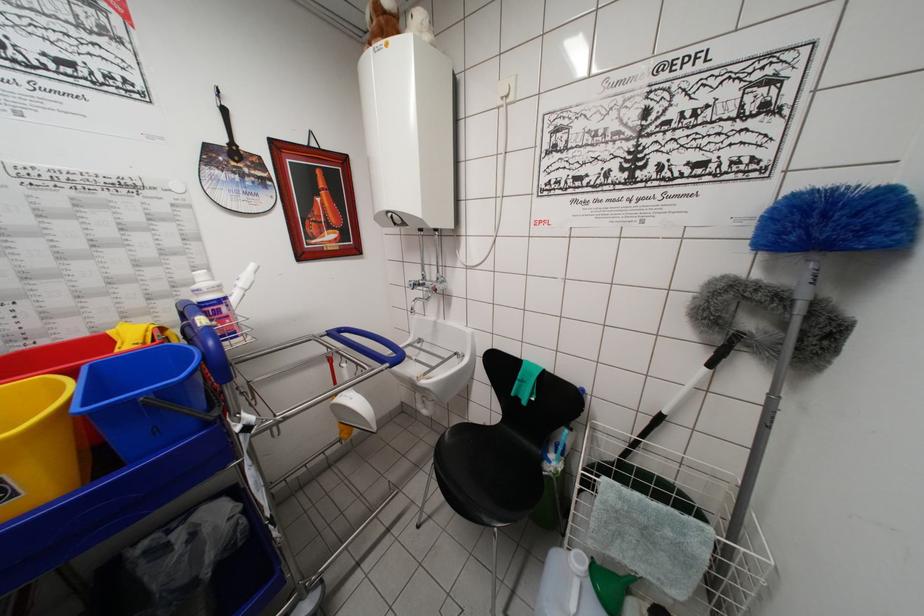
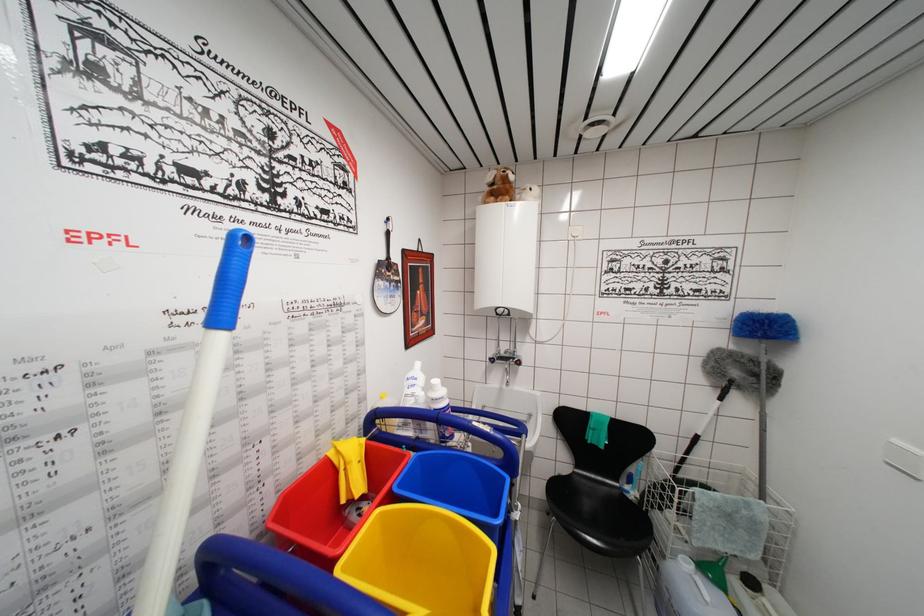
Question: Based on the continuous images, in which direction is the camera rotating? Reply with the corresponding letter.

Choices:
 (A) Left
 (B) Right
 (C) Up
 (D) Down

Answer: (B)